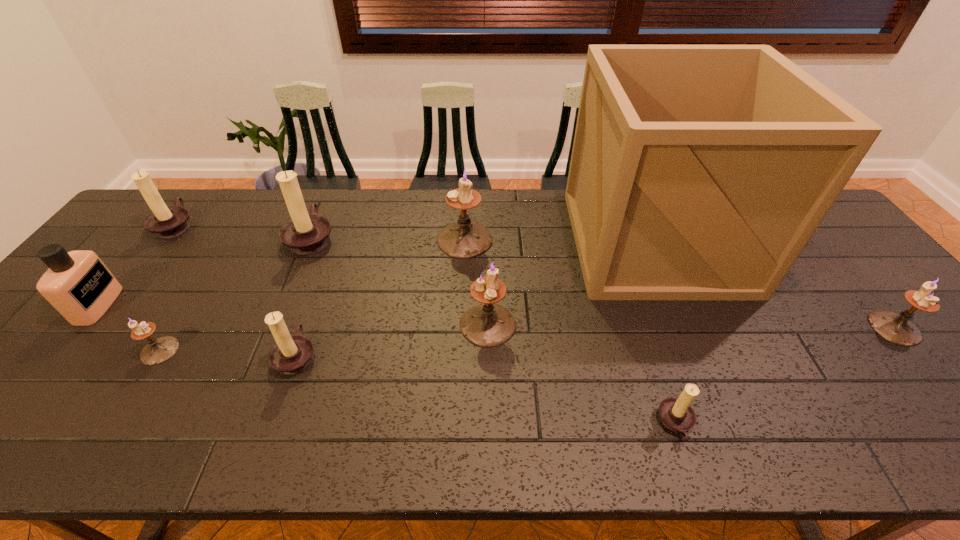
Find the location of a particular element. The width and height of the screenshot is (960, 540). perfume that is positioned at the left edge is located at coordinates click(x=78, y=285).

At what (x,y) coordinates should I click in order to perform the action: click on object located in the right edge section of the desktop. Please return your answer as a coordinate pair (x, y). This screenshot has height=540, width=960. Looking at the image, I should click on (897, 328).

Locate an element on the screen. The height and width of the screenshot is (540, 960). object that is at the far left corner is located at coordinates (166, 222).

Identify the location of free point at the far edge. This screenshot has width=960, height=540. (556, 234).

The width and height of the screenshot is (960, 540). In order to click on vacant area at the near edge in this screenshot , I will do `click(337, 430)`.

The height and width of the screenshot is (540, 960). In the image, there is a desktop. What are the coordinates of `vacant space at the left edge` in the screenshot? It's located at (120, 255).

Locate an element on the screen. This screenshot has width=960, height=540. vacant space at the far left corner of the desktop is located at coordinates (194, 191).

I want to click on vacant space that's between the smallest brown candle holder and the rightmost object, so click(x=785, y=376).

I want to click on empty location between the leftmost candle holder and the perfume, so point(136,265).

Where is `free spot between the third smallest purple candle holder and the second nearest brown candle holder`? Image resolution: width=960 pixels, height=540 pixels. free spot between the third smallest purple candle holder and the second nearest brown candle holder is located at coordinates pyautogui.click(x=392, y=340).